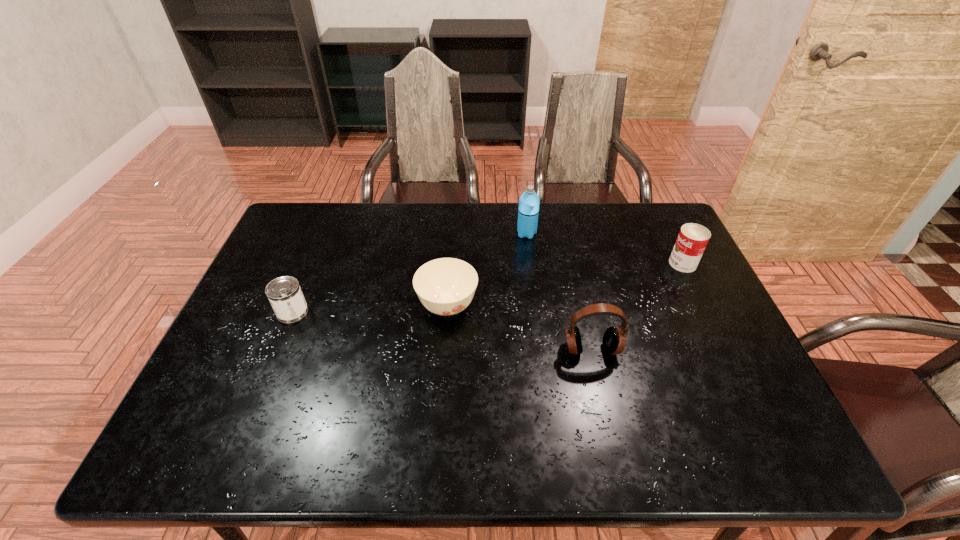
Identify the location of free space located on the ear pads of the second tallest object. This screenshot has height=540, width=960. (603, 401).

Find the location of a particular element. free spot located 0.230m on the front label of the farther can is located at coordinates (594, 264).

You are a GUI agent. You are given a task and a screenshot of the screen. Output one action in this format:
    pyautogui.click(x=<x>, y=<y>)
    Task: Click on the free region located on the front label of the farther can
    The width and height of the screenshot is (960, 540).
    Given the screenshot: What is the action you would take?
    pyautogui.click(x=617, y=264)

Find the location of `free space located on the front label of the farther can`. free space located on the front label of the farther can is located at coordinates (601, 264).

Find the location of `free region located 0.210m on the front of the fourth object from right to left`. free region located 0.210m on the front of the fourth object from right to left is located at coordinates (441, 402).

This screenshot has height=540, width=960. In order to click on vacant region located on the right of the left can in this screenshot , I will do `click(388, 312)`.

The width and height of the screenshot is (960, 540). I want to click on object located at the far edge, so click(528, 210).

I want to click on object that is at the left edge, so click(x=284, y=293).

Identify the location of object at the right edge. Image resolution: width=960 pixels, height=540 pixels. [x=692, y=240].

At what (x,y) coordinates should I click in order to perform the action: click on free space at the far edge of the desktop. Please return your answer as a coordinate pair (x, y). The image size is (960, 540). Looking at the image, I should click on (437, 231).